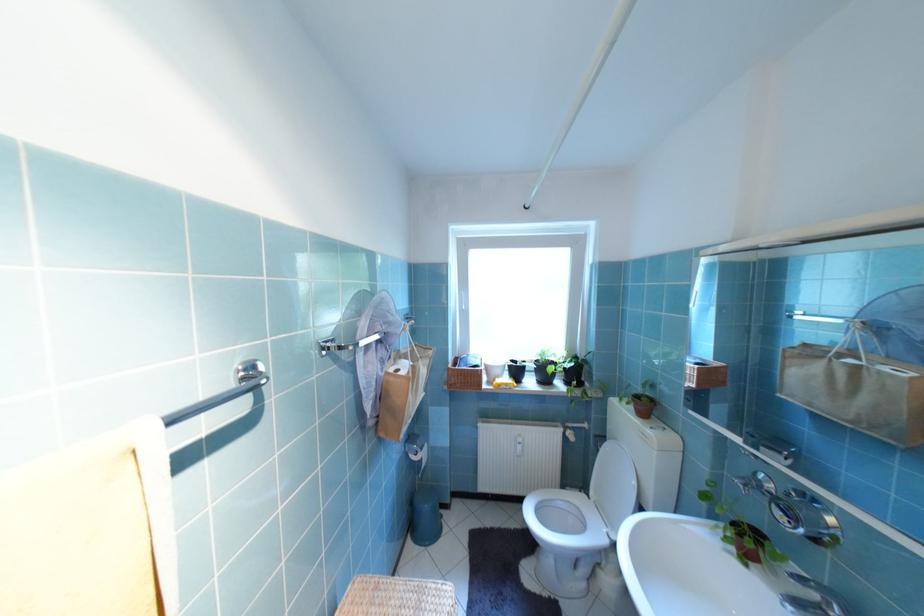
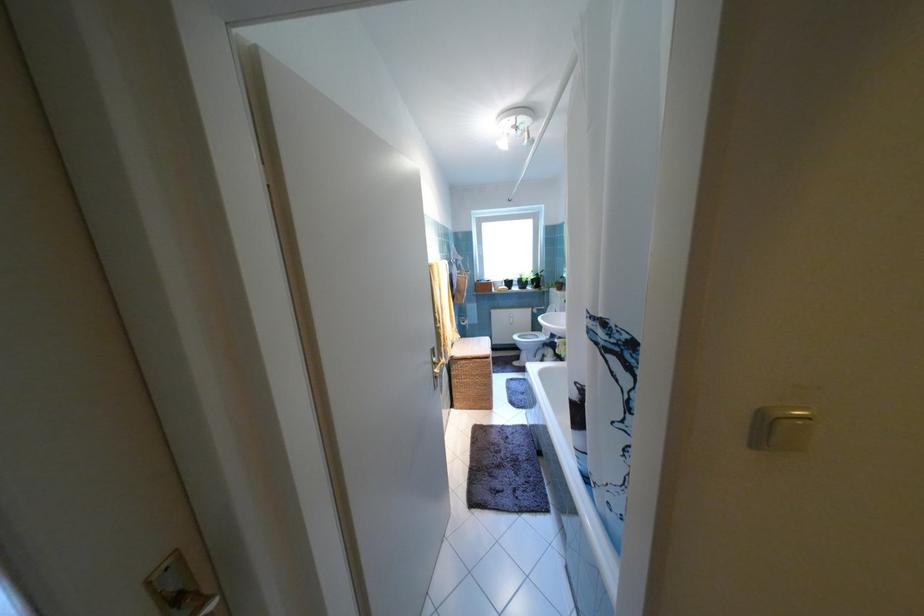
In the second image, find the point that corresponds to the point at 507,371 in the first image.

(508, 285)